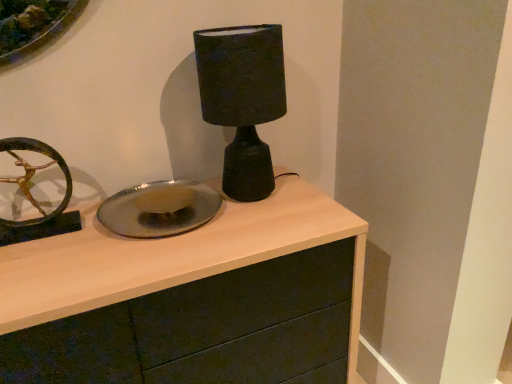
Question: Considering the relative positions of matte black lamp at center and shiny metallic plate at center in the image provided, is matte black lamp at center in front of shiny metallic plate at center?

Choices:
 (A) yes
 (B) no

Answer: (A)

Question: Is the depth of matte black lamp at center greater than that of shiny metallic plate at center?

Choices:
 (A) yes
 (B) no

Answer: (B)

Question: From the image's perspective, is matte black lamp at center below shiny metallic plate at center?

Choices:
 (A) yes
 (B) no

Answer: (B)

Question: Can you confirm if matte black lamp at center is bigger than shiny metallic plate at center?

Choices:
 (A) yes
 (B) no

Answer: (A)

Question: Does matte black lamp at center have a lesser height compared to shiny metallic plate at center?

Choices:
 (A) no
 (B) yes

Answer: (A)

Question: Is matte wood chest of drawers at center wider or thinner than matte black lamp at center?

Choices:
 (A) wide
 (B) thin

Answer: (A)

Question: Based on their sizes in the image, would you say matte wood chest of drawers at center is bigger or smaller than matte black lamp at center?

Choices:
 (A) big
 (B) small

Answer: (A)

Question: Is point (357, 306) positioned closer to the camera than point (205, 59)?

Choices:
 (A) farther
 (B) closer

Answer: (A)

Question: From a real-world perspective, is matte wood chest of drawers at center above or below matte black lamp at center?

Choices:
 (A) above
 (B) below

Answer: (B)

Question: Is shiny metallic plate at center situated inside matte black lamp at center or outside?

Choices:
 (A) outside
 (B) inside

Answer: (A)

Question: Relative to matte black lamp at center, is shiny metallic plate at center in front or behind?

Choices:
 (A) behind
 (B) front

Answer: (A)

Question: Looking at their shapes, would you say shiny metallic plate at center is wider or thinner than matte black lamp at center?

Choices:
 (A) thin
 (B) wide

Answer: (B)

Question: From their relative heights in the image, would you say shiny metallic plate at center is taller or shorter than matte black lamp at center?

Choices:
 (A) tall
 (B) short

Answer: (B)

Question: Which is correct: matte black lamp at center is inside matte wood chest of drawers at center, or outside of it?

Choices:
 (A) outside
 (B) inside

Answer: (A)

Question: From the image's perspective, relative to matte wood chest of drawers at center, is matte black lamp at center above or below?

Choices:
 (A) above
 (B) below

Answer: (A)